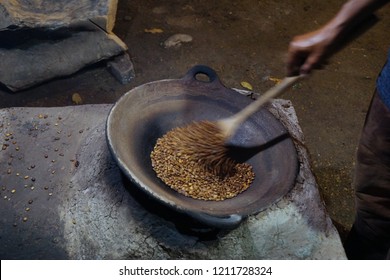
You are a GUI agent. You are given a task and a screenshot of the screen. Output one action in this format:
    pyautogui.click(x=<x>, y=<y>)
    Task: Click on the metal pan
    The height and width of the screenshot is (280, 390).
    Given the screenshot: What is the action you would take?
    pyautogui.click(x=129, y=178)